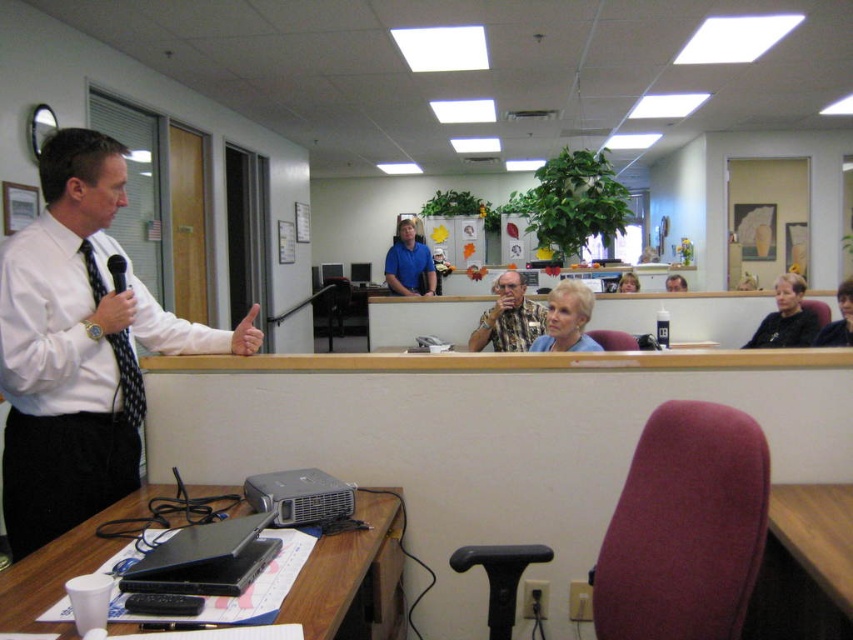
You are sitting at the back of the room and want to hand a document to the person wearing the camouflage shirt at center and the person with matte black hair at upper center. Which person should you approach first?

You should approach the camouflage shirt at center first because it is closer to you than the matte black hair at upper center.

You are an event organizer trying to arrange seating for attendees. You notice two features in the image, the camouflage shirt at center and the matte black hair at upper center. Which of these two would you consider when determining the space needed for the presenter?

The camouflage shirt at center would be considered when determining the space needed for the presenter because it is wider than the matte black hair at upper center.

You are organizing a meeting in this office and need to seat a guest. The guest requires a chair that is larger than the blue shirt at center. Is the black plastic stool at lower center suitable?

The black plastic stool at lower center is smaller than the blue shirt at center, so it is not suitable for seating the guest who needs a larger chair.